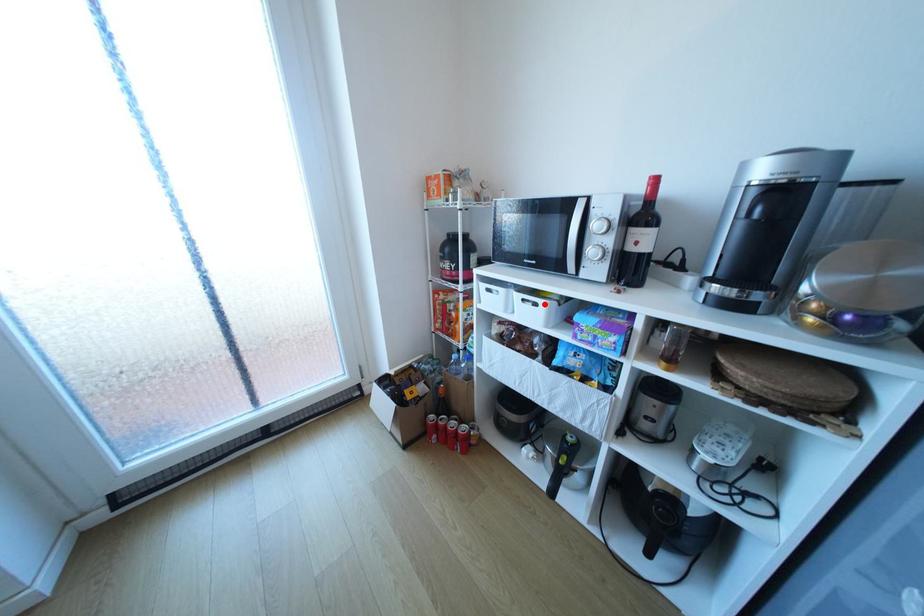
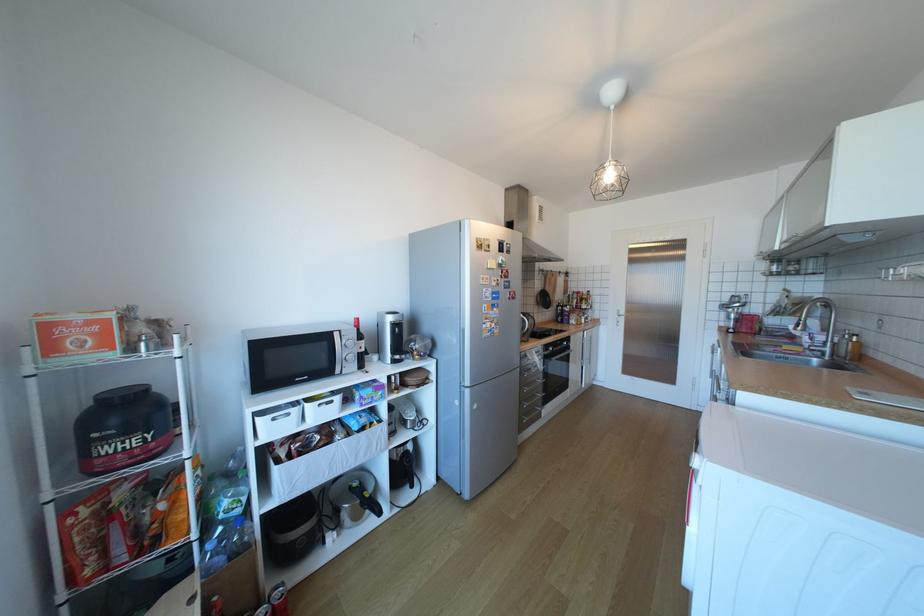
Find the pixel in the second image that matches the highlighted location in the first image.

(341, 402)